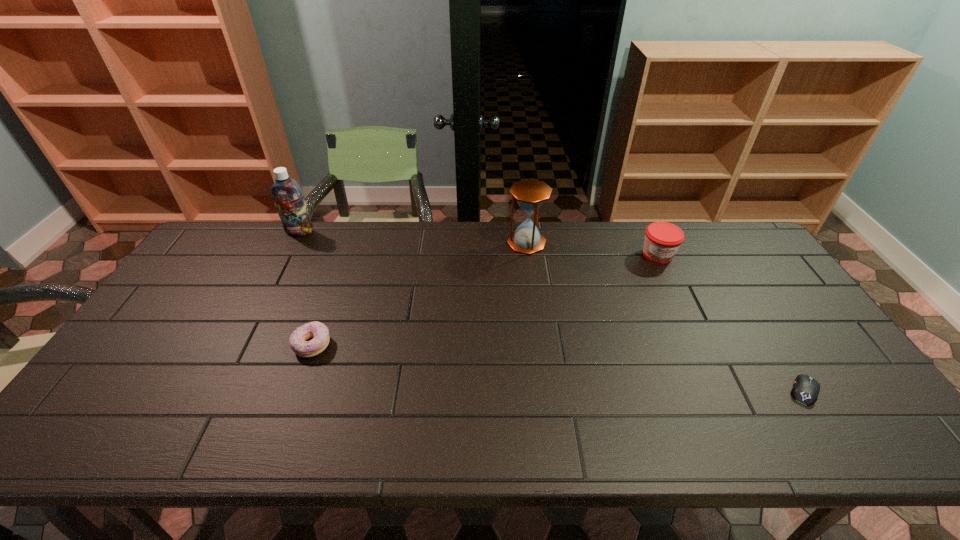
In the image, there is a desktop. At what (x,y) coordinates should I click in order to perform the action: click on vacant space at the right edge. Please return your answer as a coordinate pair (x, y). Looking at the image, I should click on (773, 280).

Find the location of a particular element. The image size is (960, 540). vacant space at the far left corner of the desktop is located at coordinates (242, 230).

Where is `free space at the near left corner of the desktop`? free space at the near left corner of the desktop is located at coordinates (133, 438).

At what (x,y) coordinates should I click in order to perform the action: click on blank region between the leftmost object and the second tallest object. Please return your answer as a coordinate pair (x, y). This screenshot has width=960, height=540. Looking at the image, I should click on click(x=413, y=238).

Locate an element on the screen. The height and width of the screenshot is (540, 960). empty space between the shortest object and the third shortest object is located at coordinates click(x=732, y=323).

What are the coordinates of `vacant point located between the second tallest object and the doughnut` in the screenshot? It's located at (420, 294).

Find the location of a particular element. Image resolution: width=960 pixels, height=540 pixels. free space between the shortest object and the jam is located at coordinates (732, 323).

Find the location of a particular element. Image resolution: width=960 pixels, height=540 pixels. free space between the nearest object and the shampoo is located at coordinates (552, 311).

I want to click on vacant space that's between the fourth tallest object and the third shortest object, so click(x=485, y=300).

Locate an element on the screen. The width and height of the screenshot is (960, 540). free spot between the fourth object from left to right and the shampoo is located at coordinates pos(479,244).